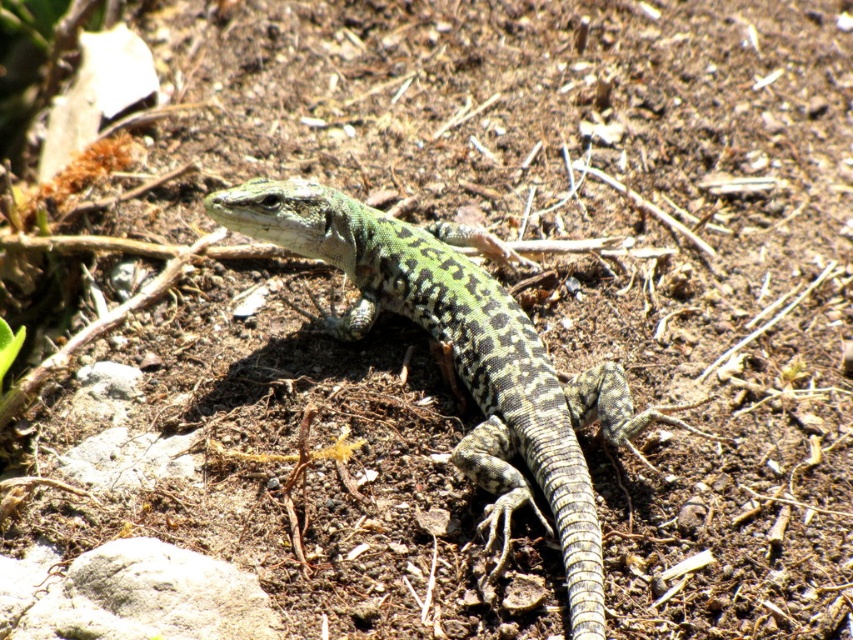
Question: Which point is farther to the camera?

Choices:
 (A) gray rough rock at lower left
 (B) green scaly lizard at center

Answer: (A)

Question: Does green scaly lizard at center have a larger size compared to gray rough rock at lower left?

Choices:
 (A) no
 (B) yes

Answer: (B)

Question: Can you confirm if green scaly lizard at center is positioned above gray rough rock at lower left?

Choices:
 (A) no
 (B) yes

Answer: (B)

Question: Is green scaly lizard at center bigger than gray rough rock at lower left?

Choices:
 (A) yes
 (B) no

Answer: (A)